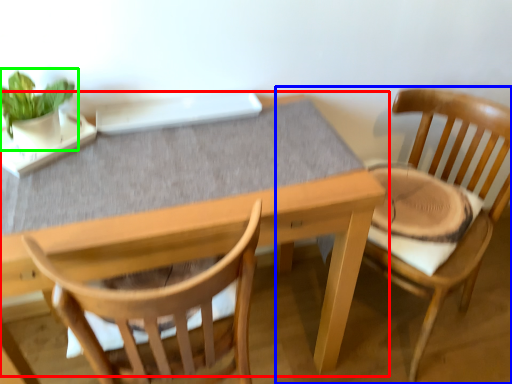
Question: Which is nearer to the table (highlighted by a red box)? chair (highlighted by a blue box) or houseplant (highlighted by a green box).

Choices:
 (A) chair
 (B) houseplant

Answer: (A)